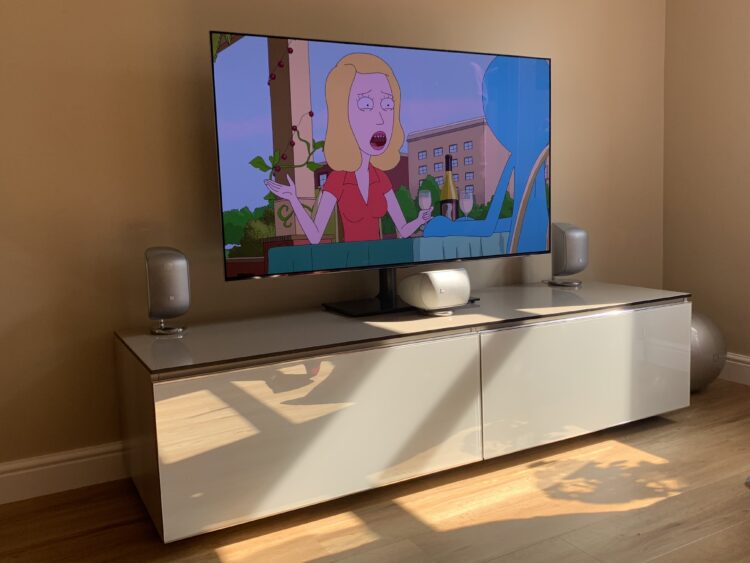
Where is `television`? Image resolution: width=750 pixels, height=563 pixels. television is located at coordinates (410, 142).